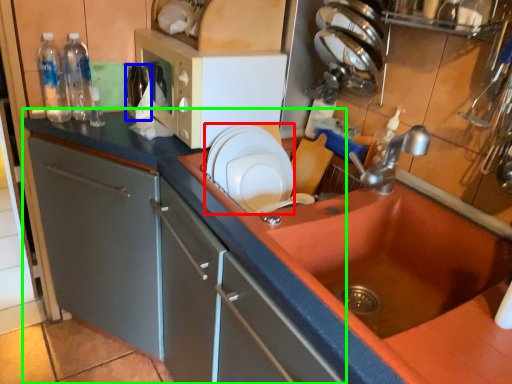
Question: Considering the real-world distances, which object is farthest from appliance (highlighted by a red box)? bottle (highlighted by a blue box) or countertop (highlighted by a green box)?

Choices:
 (A) bottle
 (B) countertop

Answer: (A)